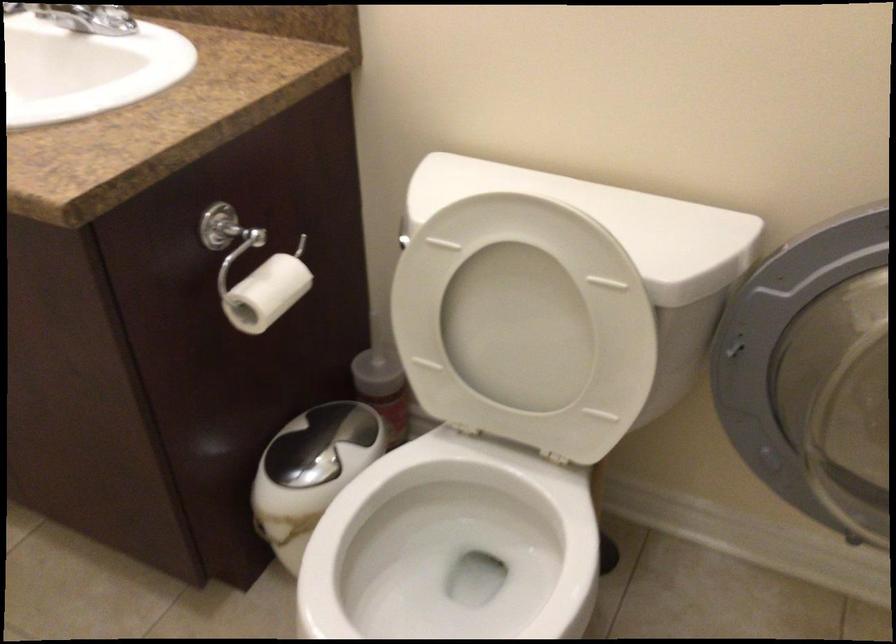
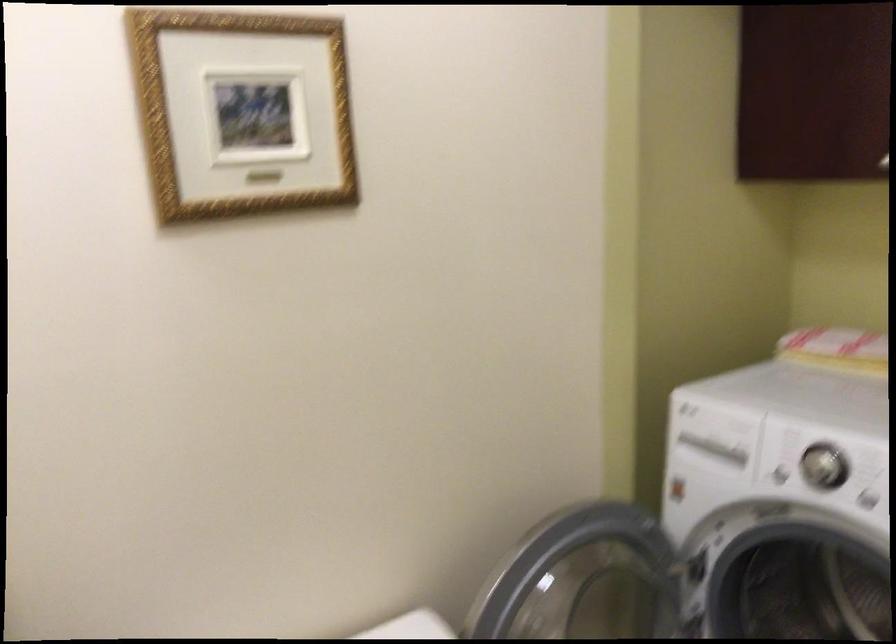
Question: The camera is either moving clockwise (left) or counter-clockwise (right) around the object. The first image is from the beginning of the video and the second image is from the end. Is the camera moving left or right when shooting the video?

Choices:
 (A) Left
 (B) Right

Answer: (A)